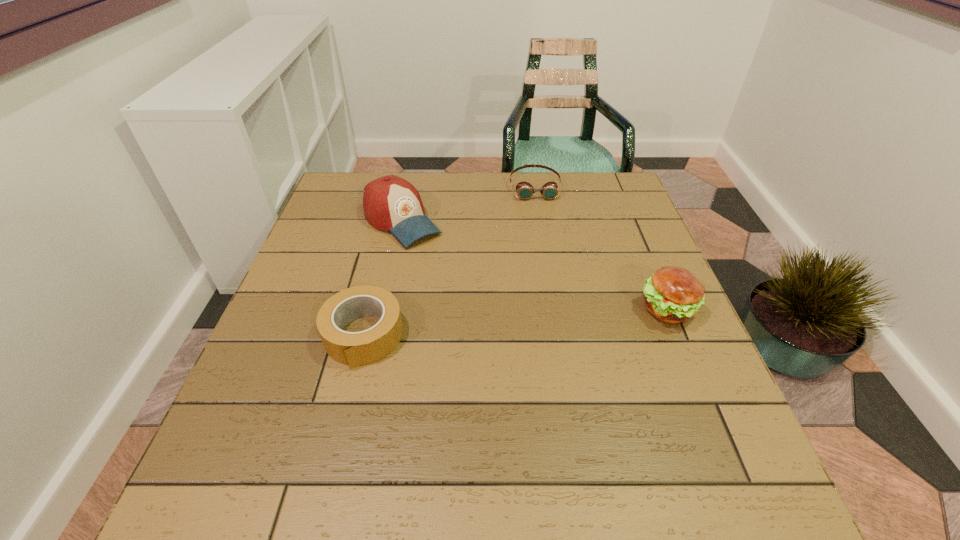
The width and height of the screenshot is (960, 540). I want to click on vacant region located 0.260m through the lenses of the second object from right to left, so click(x=547, y=258).

Where is `blank space located 0.190m through the lenses of the second object from right to left`? blank space located 0.190m through the lenses of the second object from right to left is located at coordinates (544, 241).

Locate an element on the screen. This screenshot has width=960, height=540. vacant space located 0.260m through the lenses of the second object from right to left is located at coordinates (547, 258).

Identify the location of baseball cap situated at the far edge. Image resolution: width=960 pixels, height=540 pixels. (390, 203).

This screenshot has height=540, width=960. I want to click on goggles at the far edge, so 525,190.

Locate an element on the screen. This screenshot has height=540, width=960. duct tape positioned at the left edge is located at coordinates (354, 349).

Where is `baseball cap that is positioned at the left edge`? The width and height of the screenshot is (960, 540). baseball cap that is positioned at the left edge is located at coordinates 390,203.

What are the coordinates of `object that is positioned at the right edge` in the screenshot? It's located at (673, 294).

At what (x,y) coordinates should I click in order to perform the action: click on object that is at the far left corner. Please return your answer as a coordinate pair (x, y). The width and height of the screenshot is (960, 540). Looking at the image, I should click on (390, 203).

This screenshot has height=540, width=960. What are the coordinates of `vacant space at the far edge` in the screenshot? It's located at (436, 174).